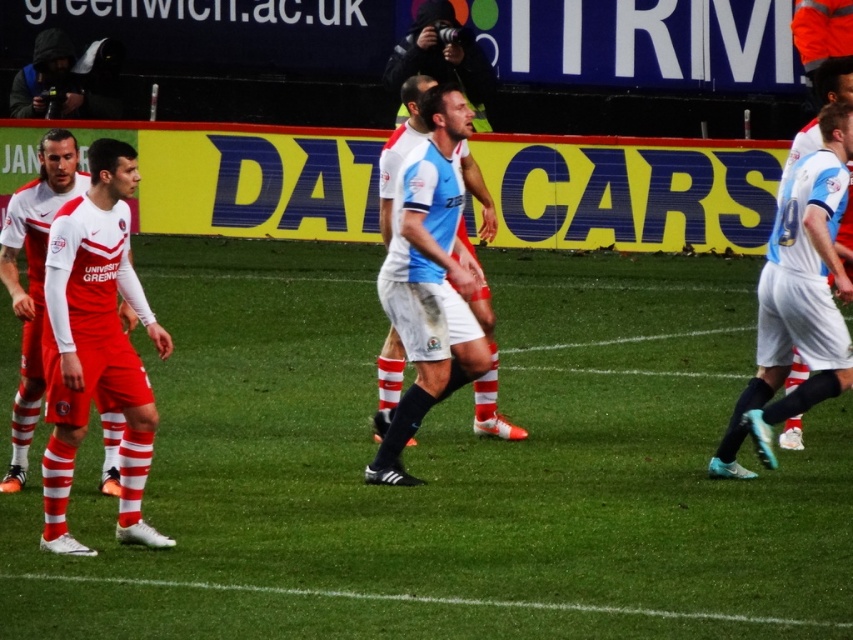
You are a soccer referee positioned at the center circle. You notice the matte red uniform at left and the light blue jersey at center. Which player is closer to you?

The matte red uniform at left is closer to you because it is in front of the light blue jersey at center.

You are a soccer coach analyzing the game. You see the matte red uniform at left on the field. Can you determine its exact location using coordinates?

The matte red uniform at left is located at coordinates point (96, 346).